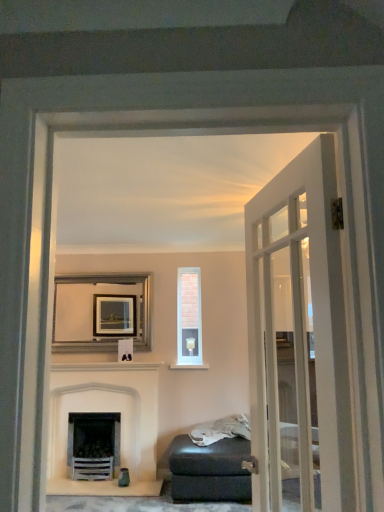
Question: From their relative heights in the image, would you say silver metallic picture frame at center is taller or shorter than white stone fireplace at lower left?

Choices:
 (A) short
 (B) tall

Answer: (A)

Question: Considering the positions of silver metallic picture frame at center and white stone fireplace at lower left in the image, is silver metallic picture frame at center wider or thinner than white stone fireplace at lower left?

Choices:
 (A) wide
 (B) thin

Answer: (B)

Question: Which object is positioned farthest from the white stone fireplace at lower left?

Choices:
 (A) matte black ottoman at lower center
 (B) white brick wall at center
 (C) silver metallic picture frame at center
 (D) white glass door at right

Answer: (D)

Question: Which is farther from the white glass door at right?

Choices:
 (A) silver metallic picture frame at center
 (B) white brick wall at center
 (C) white stone fireplace at lower left
 (D) matte black ottoman at lower center

Answer: (A)